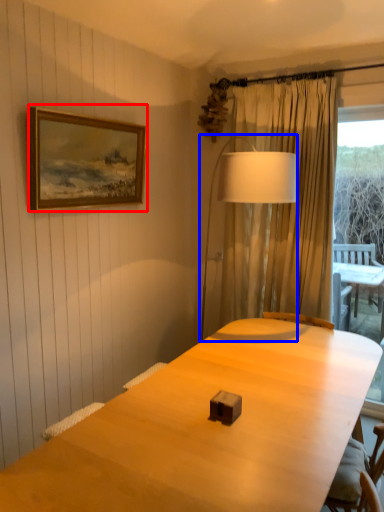
Question: Among these objects, which one is nearest to the camera, picture frame (highlighted by a red box) or table lamp (highlighted by a blue box)?

Choices:
 (A) picture frame
 (B) table lamp

Answer: (A)